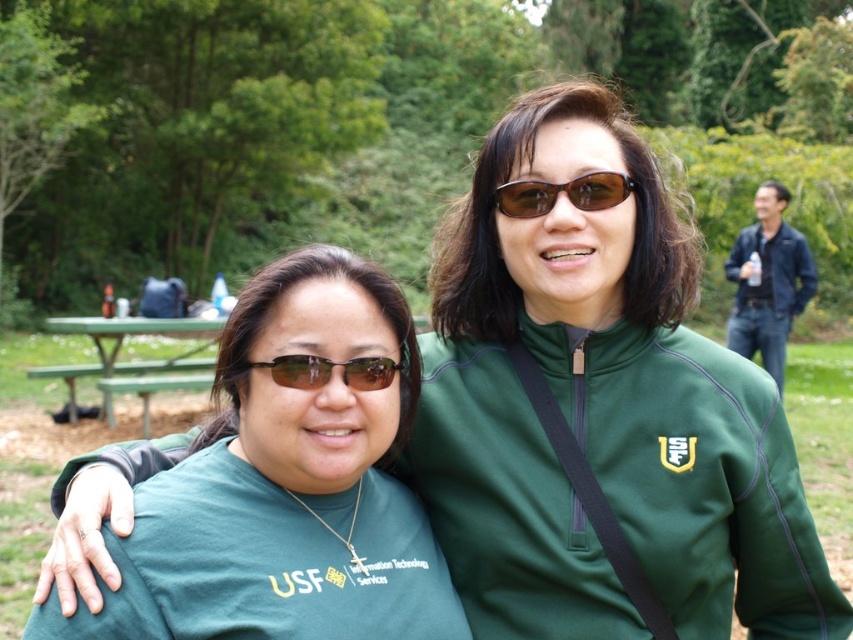
Question: Considering the real-world distances, which object is closest to the matte black sunglasses at center?

Choices:
 (A) green painted wood picnic table at lower left
 (B) green matte shirt at center

Answer: (B)

Question: Among these objects, which one is farthest from the camera?

Choices:
 (A) matte black sunglasses at center
 (B) black leather jacket at upper right

Answer: (B)

Question: Which point is closer to the camera?

Choices:
 (A) green matte shirt at center
 (B) green painted wood picnic table at lower left
 (C) brown matte sunglasses at center

Answer: (A)

Question: Is green matte shirt at center thinner than matte black sunglasses at center?

Choices:
 (A) yes
 (B) no

Answer: (B)

Question: Observing the image, what is the correct spatial positioning of green matte shirt at center in reference to black leather jacket at upper right?

Choices:
 (A) left
 (B) right

Answer: (A)

Question: Considering the relative positions of green matte shirt at center and brown matte sunglasses at center in the image provided, where is green matte shirt at center located with respect to brown matte sunglasses at center?

Choices:
 (A) right
 (B) left

Answer: (B)